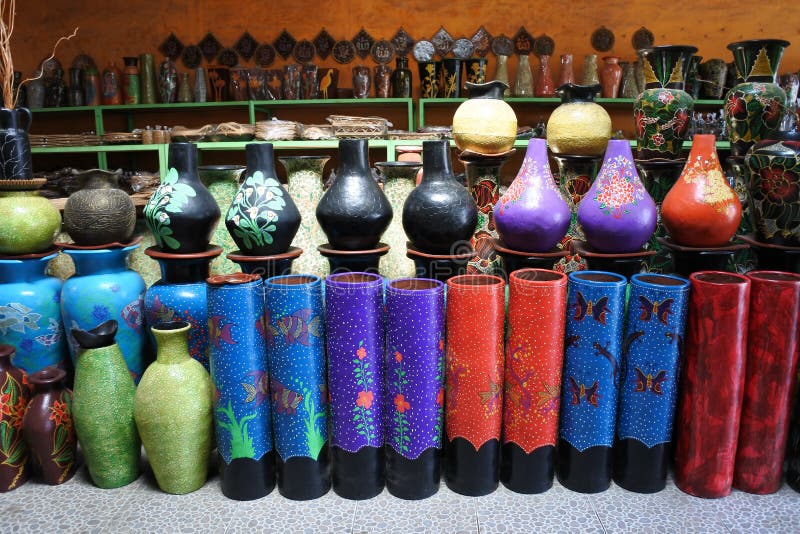
This screenshot has height=534, width=800. Identify the location of table. (472, 525).